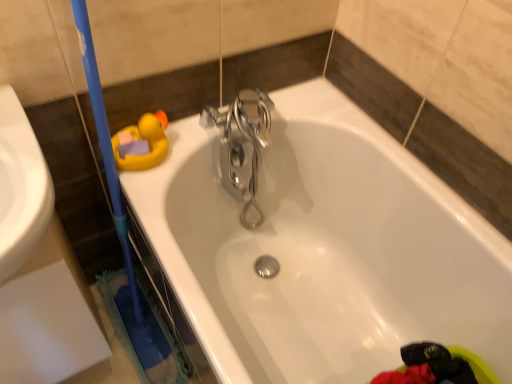
Measure the distance between point (x=252, y=148) and camera.

Point (x=252, y=148) and camera are 3.61 feet apart.

Image resolution: width=512 pixels, height=384 pixels. I want to click on polished chrome faucet at center, so click(x=242, y=144).

What do you see at coordinates (242, 144) in the screenshot? I see `polished chrome faucet at center` at bounding box center [242, 144].

Identify the location of white glossy bathtub at upper center. (324, 250).

Measure the distance between white glossy bathtub at upper center and camera.

The depth of white glossy bathtub at upper center is 28.89 inches.

What do you see at coordinates (324, 250) in the screenshot? This screenshot has width=512, height=384. I see `white glossy bathtub at upper center` at bounding box center [324, 250].

At what (x,y) coordinates should I click in order to perform the action: click on polished chrome faucet at center. Please return your answer as a coordinate pair (x, y). Image resolution: width=512 pixels, height=384 pixels. Looking at the image, I should click on point(242,144).

Would you say polished chrome faucet at center is to the left or to the right of white glossy bathtub at upper center in the picture?

Clearly, polished chrome faucet at center is on the left of white glossy bathtub at upper center in the image.

Relative to white glossy bathtub at upper center, is polished chrome faucet at center in front or behind?

In the image, polished chrome faucet at center appears behind white glossy bathtub at upper center.

Does point (259, 152) appear closer or farther from the camera than point (479, 296)?

Point (259, 152).

From the image's perspective, between polished chrome faucet at center and white glossy bathtub at upper center, which one is located above?

From the image's view, polished chrome faucet at center is above.

From a real-world perspective, is polished chrome faucet at center located beneath white glossy bathtub at upper center?

No, from a real-world perspective, polished chrome faucet at center is not below white glossy bathtub at upper center.

Is polished chrome faucet at center wider than white glossy bathtub at upper center?

No.

Looking at this image, considering the sizes of objects polished chrome faucet at center and white glossy bathtub at upper center in the image provided, who is shorter, polished chrome faucet at center or white glossy bathtub at upper center?

With less height is polished chrome faucet at center.

Based on their sizes in the image, would you say polished chrome faucet at center is bigger or smaller than white glossy bathtub at upper center?

In the image, polished chrome faucet at center appears to be smaller than white glossy bathtub at upper center.

From the picture: Is polished chrome faucet at center inside or outside of white glossy bathtub at upper center?

polished chrome faucet at center is enclosed within white glossy bathtub at upper center.

Consider the image. Is polished chrome faucet at center next to white glossy bathtub at upper center and touching it?

polished chrome faucet at center and white glossy bathtub at upper center are clearly separated.

Could you tell me if polished chrome faucet at center is turned towards white glossy bathtub at upper center?

Yes, polished chrome faucet at center is oriented towards white glossy bathtub at upper center.

How many degrees apart are the facing directions of polished chrome faucet at center and white glossy bathtub at upper center?

The angle between the facing direction of polished chrome faucet at center and the facing direction of white glossy bathtub at upper center is 90 degrees.

This screenshot has height=384, width=512. I want to click on bathtub on the right of polished chrome faucet at center, so click(x=324, y=250).

Is white glossy bathtub at upper center at the left side of polished chrome faucet at center?

In fact, white glossy bathtub at upper center is to the right of polished chrome faucet at center.

Relative to polished chrome faucet at center, is white glossy bathtub at upper center in front or behind?

white glossy bathtub at upper center is in front of polished chrome faucet at center.

Does point (330, 329) lie in front of point (267, 119)?

No, (330, 329) is further to viewer.

From the image's perspective, does white glossy bathtub at upper center appear lower than polished chrome faucet at center?

Yes.

From a real-world perspective, is white glossy bathtub at upper center on polished chrome faucet at center?

Actually, white glossy bathtub at upper center is physically below polished chrome faucet at center in the real world.

Is white glossy bathtub at upper center thinner than polished chrome faucet at center?

No, white glossy bathtub at upper center is not thinner than polished chrome faucet at center.

Between white glossy bathtub at upper center and polished chrome faucet at center, which one has more height?

white glossy bathtub at upper center.

Is white glossy bathtub at upper center bigger or smaller than polished chrome faucet at center?

In the image, white glossy bathtub at upper center appears to be larger than polished chrome faucet at center.

Do you think white glossy bathtub at upper center is within polished chrome faucet at center, or outside of it?

white glossy bathtub at upper center is located beyond the bounds of polished chrome faucet at center.

Are white glossy bathtub at upper center and polished chrome faucet at center located far from each other?

No, white glossy bathtub at upper center is in close proximity to polished chrome faucet at center.

Is polished chrome faucet at center at the back of white glossy bathtub at upper center?

That's not correct — white glossy bathtub at upper center is not looking away from polished chrome faucet at center.

This screenshot has width=512, height=384. I want to click on tap above the white glossy bathtub at upper center (from a real-world perspective), so click(242, 144).

This screenshot has height=384, width=512. In order to click on bathtub on the right of polished chrome faucet at center in this screenshot , I will do `click(324, 250)`.

This screenshot has height=384, width=512. Identify the location of tap behind the white glossy bathtub at upper center. (242, 144).